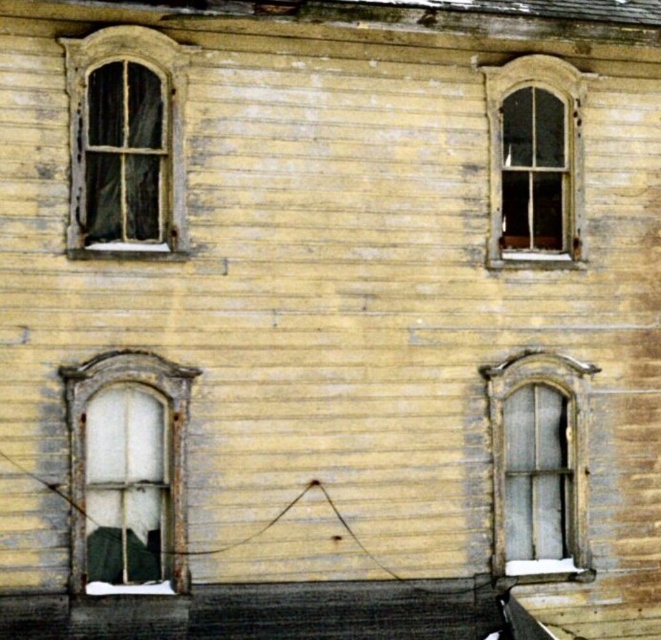
Question: Estimate the real-world distances between objects in this image. Which object is farther from the wooden window at upper left?

Choices:
 (A) translucent glass window at center
 (B) matte gray glass window at lower right
 (C) wooden window at upper right

Answer: (B)

Question: Can you confirm if translucent glass window at center is positioned below matte gray glass window at lower right?

Choices:
 (A) no
 (B) yes

Answer: (A)

Question: Considering the real-world distances, which object is farthest from the translucent glass window at center?

Choices:
 (A) wooden window at upper right
 (B) matte gray glass window at lower right

Answer: (A)

Question: Considering the real-world distances, which object is closest to the translucent glass window at center?

Choices:
 (A) wooden window at upper right
 (B) wooden window at upper left

Answer: (B)

Question: Can you confirm if translucent glass window at center is positioned above wooden window at upper right?

Choices:
 (A) yes
 (B) no

Answer: (B)

Question: Where is wooden window at upper left located in relation to wooden window at upper right in the image?

Choices:
 (A) right
 (B) left

Answer: (B)